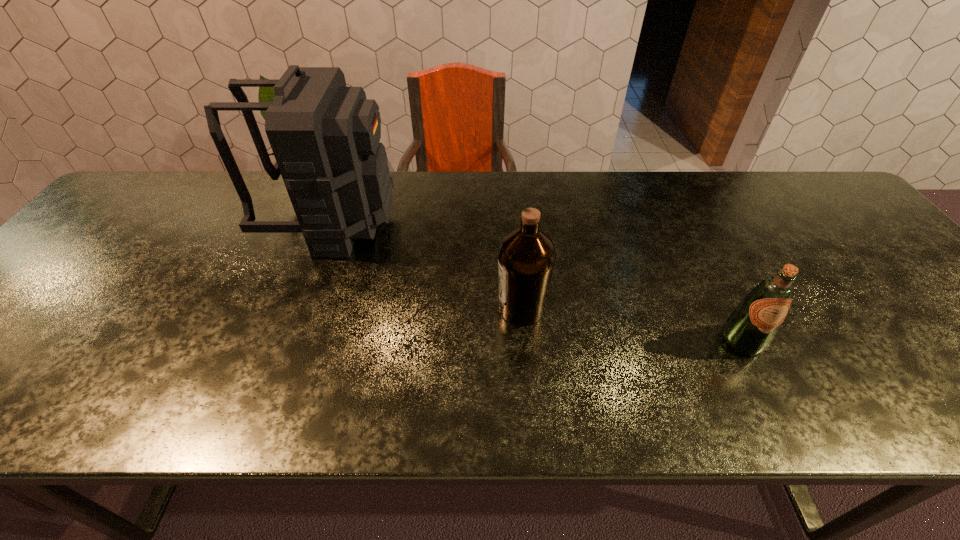
The width and height of the screenshot is (960, 540). I want to click on free space located 0.110m on the front-facing side of the right olive oil, so click(x=776, y=407).

At what (x,y) coordinates should I click in order to perform the action: click on object that is at the far edge. Please return your answer as a coordinate pair (x, y). The image size is (960, 540). Looking at the image, I should click on (325, 136).

Where is `vacant area at the far edge of the desktop`? vacant area at the far edge of the desktop is located at coordinates (253, 174).

The width and height of the screenshot is (960, 540). In order to click on vacant region at the near edge of the desktop in this screenshot , I will do `click(682, 382)`.

You are a GUI agent. You are given a task and a screenshot of the screen. Output one action in this format:
    pyautogui.click(x=<x>, y=<y>)
    Task: Click on the free space at the left edge
    
    Given the screenshot: What is the action you would take?
    pyautogui.click(x=81, y=313)

Image resolution: width=960 pixels, height=540 pixels. I want to click on vacant region at the right edge of the desktop, so click(825, 220).

You are a GUI agent. You are given a task and a screenshot of the screen. Output one action in this format:
    pyautogui.click(x=<x>, y=<y>)
    Task: Click on the free area in between the second shortest object and the shortest object
    
    Given the screenshot: What is the action you would take?
    pyautogui.click(x=632, y=325)

The image size is (960, 540). I want to click on blank region between the left olive oil and the shortest object, so click(x=632, y=325).

I want to click on vacant area that lies between the second object from right to left and the rightmost object, so click(632, 325).

Image resolution: width=960 pixels, height=540 pixels. Identify the location of vacant space that is in between the second tallest object and the tallest object. [427, 266].